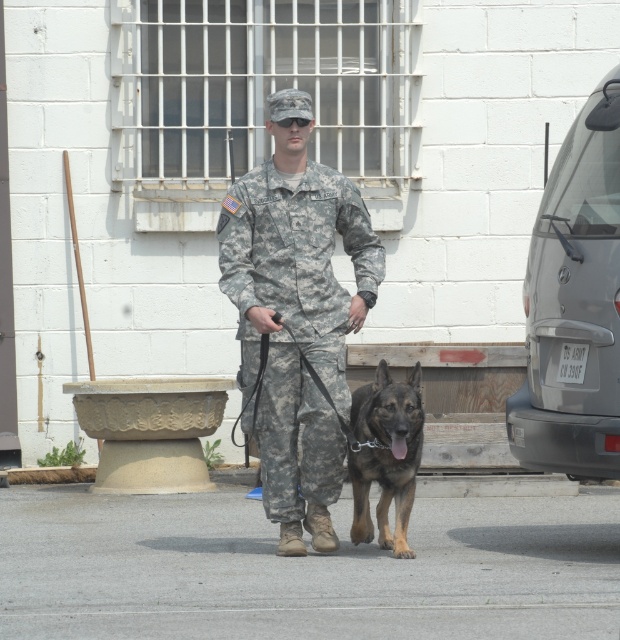
Does camouflage uniform at center appear on the left side of brown fur dog at center?

Indeed, camouflage uniform at center is positioned on the left side of brown fur dog at center.

Can you confirm if camouflage uniform at center is bigger than brown fur dog at center?

Indeed, camouflage uniform at center has a larger size compared to brown fur dog at center.

Describe the element at coordinates (296, 316) in the screenshot. I see `camouflage uniform at center` at that location.

Locate an element on the screen. camouflage uniform at center is located at coordinates (296, 316).